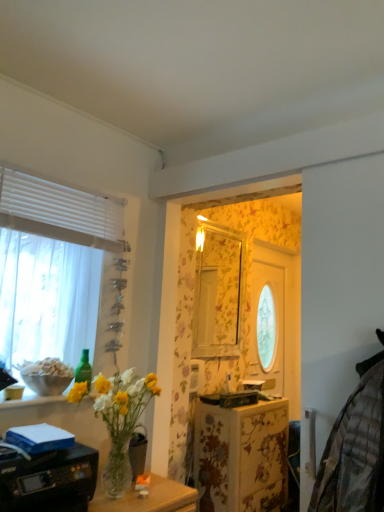
Find the location of a particular element. Image resolution: width=384 pixels, height=512 pixels. clear glass vase at lower center is located at coordinates (148, 498).

The height and width of the screenshot is (512, 384). Describe the element at coordinates (148, 498) in the screenshot. I see `clear glass vase at lower center` at that location.

Describe the element at coordinates (60, 211) in the screenshot. I see `white sheer curtain at left` at that location.

This screenshot has height=512, width=384. Describe the element at coordinates (84, 370) in the screenshot. I see `green glass bottle at upper left` at that location.

Measure the distance between point (89, 365) and camera.

A distance of 2.00 meters exists between point (89, 365) and camera.

What is the approximate height of clear glass vase at lower left?

clear glass vase at lower left is 18.11 inches tall.

Locate an element on the screen. The image size is (384, 512). clear glass vase at lower center is located at coordinates (148, 498).

Does point (82, 202) lie behind point (91, 373)?

No, (82, 202) is in front of (91, 373).

From the image's perspective, is white sheer curtain at left above green glass bottle at upper left?

Indeed, from the image's perspective, white sheer curtain at left is shown above green glass bottle at upper left.

Locate an element on the screen. The height and width of the screenshot is (512, 384). bottle located on the right of white sheer curtain at left is located at coordinates (84, 370).

Looking at this image, which object is more forward, white sheer curtain at left or green glass bottle at upper left?

white sheer curtain at left.

Locate an element on the screen. This screenshot has height=512, width=384. window above the clear glass vase at lower left (from the image's perspective) is located at coordinates (60, 211).

From the image's perspective, which one is positioned lower, white sheer curtain at left or clear glass vase at lower left?

clear glass vase at lower left appears lower in the image.

Is white sheer curtain at left looking in the opposite direction of clear glass vase at lower left?

That's not correct — white sheer curtain at left is not looking away from clear glass vase at lower left.

How many degrees apart are the facing directions of white sheer curtain at left and clear glass vase at lower left?

There is a 0.329-degree angle between the facing directions of white sheer curtain at left and clear glass vase at lower left.

How distant is clear glass vase at lower center from white sheer curtain at left?

They are 1.13 meters apart.

Does clear glass vase at lower center touch white sheer curtain at left?

No, clear glass vase at lower center is not with white sheer curtain at left.

Could you tell me if clear glass vase at lower center is turned towards white sheer curtain at left?

No, clear glass vase at lower center is not aimed at white sheer curtain at left.

Which is closer to the camera, [146,511] or [87,358]?

Point [146,511] is positioned closer to the camera compared to point [87,358].

Which of these two, clear glass vase at lower center or green glass bottle at upper left, stands shorter?

green glass bottle at upper left.

Looking at the image, does clear glass vase at lower center seem bigger or smaller compared to green glass bottle at upper left?

clear glass vase at lower center is bigger than green glass bottle at upper left.

Considering the points (1, 488) and (88, 349), which point is in front, point (1, 488) or point (88, 349)?

The point (1, 488) is more forward.

Is black plastic printer at lower left looking in the opposite direction of green glass bottle at upper left?

No.

From the image's perspective, does black plastic printer at lower left appear lower than green glass bottle at upper left?

Yes.

Which of these two, black plastic printer at lower left or green glass bottle at upper left, is wider?

Wider between the two is black plastic printer at lower left.

Is clear glass vase at lower left to the left of clear glass vase at lower center from the viewer's perspective?

Yes, clear glass vase at lower left is to the left of clear glass vase at lower center.

Looking at the image, does clear glass vase at lower left seem bigger or smaller compared to clear glass vase at lower center?

Considering their sizes, clear glass vase at lower left takes up less space than clear glass vase at lower center.

Considering the relative sizes of clear glass vase at lower left and clear glass vase at lower center in the image provided, is clear glass vase at lower left shorter than clear glass vase at lower center?

No.

Find the location of a particular element. The image size is (384, 512). houseplant behind the clear glass vase at lower center is located at coordinates [122, 420].

Does point (87, 387) appear closer or farther from the camera than point (167, 505)?

Clearly, point (87, 387) is more distant from the camera than point (167, 505).

Is clear glass vase at lower center at the back of green glass bottle at upper left?

green glass bottle at upper left does not have its back to clear glass vase at lower center.

Based on their sizes in the image, would you say green glass bottle at upper left is bigger or smaller than clear glass vase at lower center?

In the image, green glass bottle at upper left appears to be smaller than clear glass vase at lower center.

Which is more to the left, green glass bottle at upper left or clear glass vase at lower center?

From the viewer's perspective, green glass bottle at upper left appears more on the left side.

Where is `window above the green glass bottle at upper left (from a real-world perspective)`? This screenshot has height=512, width=384. window above the green glass bottle at upper left (from a real-world perspective) is located at coordinates (60, 211).

In the image, there is a white sheer curtain at left. Where is `houseplant below it (from a real-world perspective)`? This screenshot has width=384, height=512. houseplant below it (from a real-world perspective) is located at coordinates (122, 420).

Estimate the real-world distances between objects in this image. Which object is further from clear glass vase at lower left, clear glass vase at lower center or green glass bottle at upper left?

green glass bottle at upper left lies further to clear glass vase at lower left than the other object.

From the image, which object appears to be farther from green glass bottle at upper left, clear glass vase at lower center or black plastic printer at lower left?

clear glass vase at lower center lies further to green glass bottle at upper left than the other object.

Which object lies nearer to the anchor point green glass bottle at upper left, white sheer curtain at left or black plastic printer at lower left?

Based on the image, black plastic printer at lower left appears to be nearer to green glass bottle at upper left.

Which object lies further to the anchor point black plastic printer at lower left, white sheer curtain at left or green glass bottle at upper left?

The object further to black plastic printer at lower left is white sheer curtain at left.

Considering their positions, is green glass bottle at upper left positioned closer to clear glass vase at lower left than white sheer curtain at left?

green glass bottle at upper left.

When comparing their distances from clear glass vase at lower center, does green glass bottle at upper left or clear glass vase at lower left seem further?

green glass bottle at upper left.

Which object lies nearer to the anchor point black plastic printer at lower left, clear glass vase at lower center or green glass bottle at upper left?

Based on the image, clear glass vase at lower center appears to be nearer to black plastic printer at lower left.

Looking at the image, which one is located further to clear glass vase at lower center, black plastic printer at lower left or white sheer curtain at left?

white sheer curtain at left is further to clear glass vase at lower center.

The image size is (384, 512). I want to click on bottle between white sheer curtain at left and clear glass vase at lower left in the up-down direction, so click(x=84, y=370).

This screenshot has width=384, height=512. Find the location of `bottle between white sheer curtain at left and clear glass vase at lower center in the up-down direction`. bottle between white sheer curtain at left and clear glass vase at lower center in the up-down direction is located at coordinates (84, 370).

I want to click on printer that lies between clear glass vase at lower left and clear glass vase at lower center from top to bottom, so click(x=48, y=479).

Find the location of `houseplant between clear glass vase at lower center and green glass bottle at upper left along the z-axis`. houseplant between clear glass vase at lower center and green glass bottle at upper left along the z-axis is located at coordinates (122, 420).